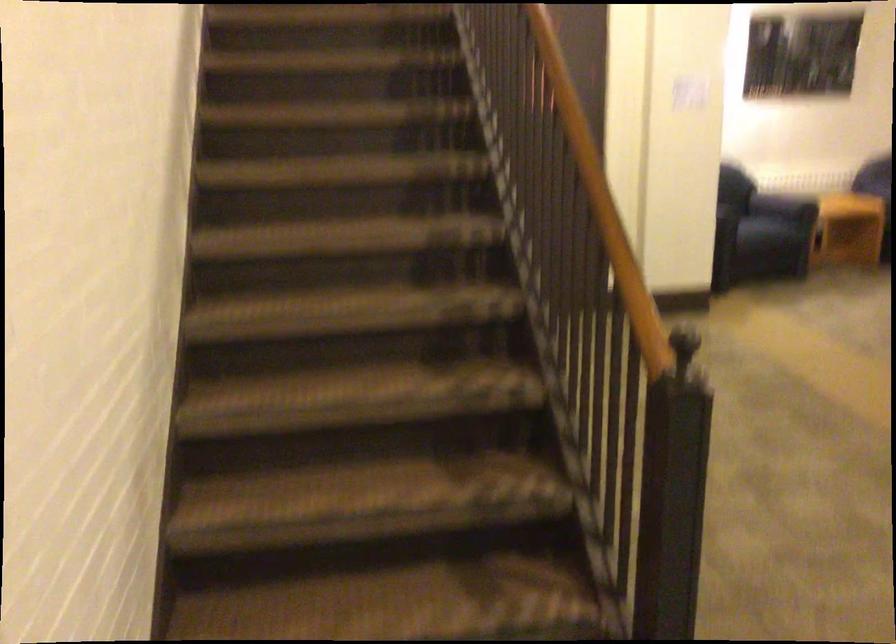
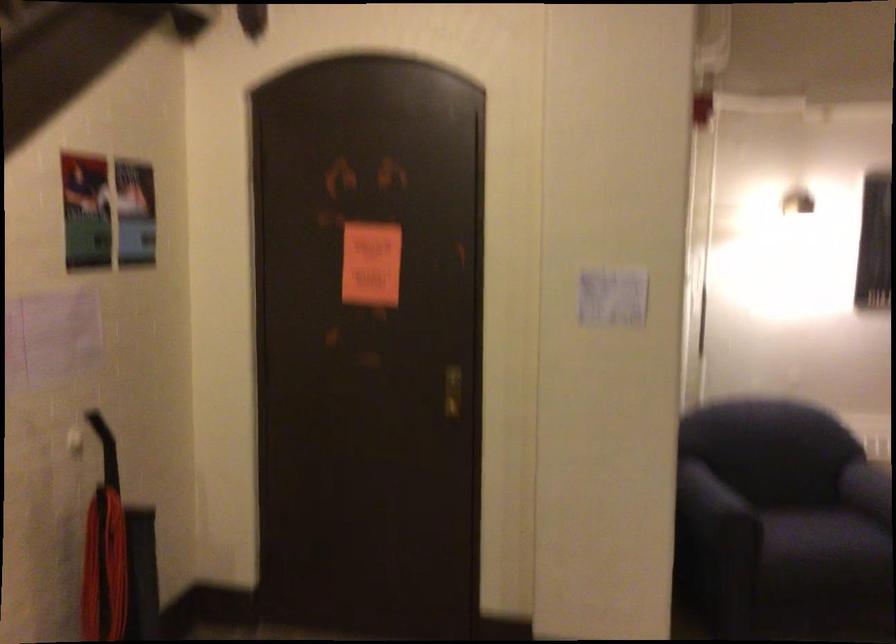
Consider the image. What movement of the cameraman would produce the second image?

The cameraman walked toward right, forward.